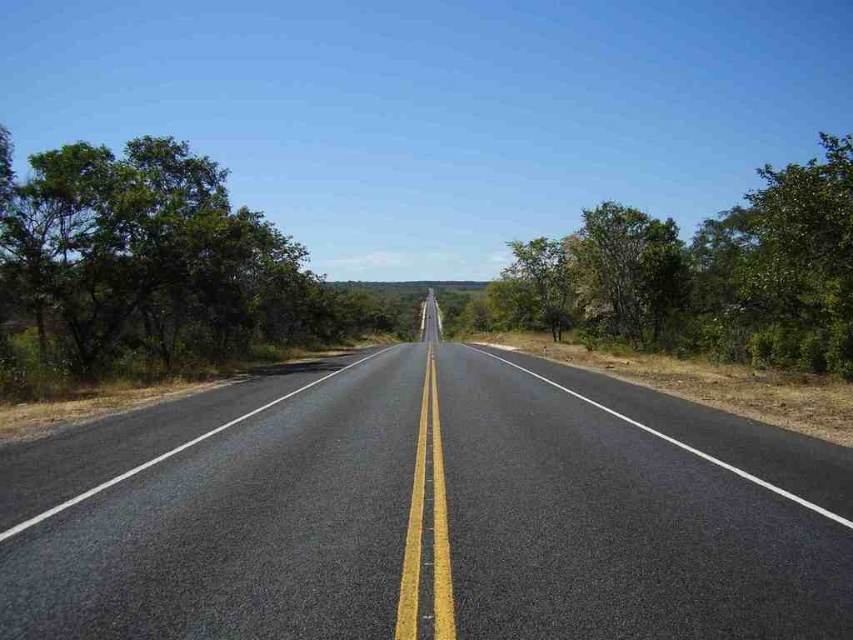
You are a driver planning to park your car on the asphalt road at center. There is a point marked at coordinates (426,513). Is this point suitable for parking?

The point marked at coordinates (426,513) is on the asphalt road at center. Since parking on the center of the road is typically prohibited due to the double yellow line indicating no passing zones, this point is not suitable for parking.

You are driving on the two lane road and see the green leafy tree at left and the green leafy tree at right. Which tree is taller?

The green leafy tree at right is taller than the green leafy tree at left.

Looking at this image, you are driving a car with a length of 5 meters. Your car is parked parallel to the two lanes of the road. You want to move your car from its current position to the other side of the road, passing between the green leafy tree at left and the nearest object on the right. Can your car fit through the gap without any part of it touching either object?

The distance between the green leafy tree at left and the nearest object on the right is 21.54 meters. Since your car is only 5 meters long, there is sufficient space for it to pass through the gap without touching either object.